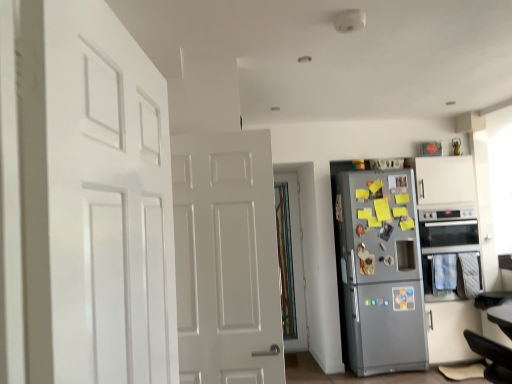
Question: From a real-world perspective, is white matte door at left, positioned as the 1th door in left-to-right order, above or below translucent glass door at center, the 2th door positioned from the left?

Choices:
 (A) below
 (B) above

Answer: (B)

Question: Is white matte door at left, positioned as the 1th door in left-to-right order, wider or thinner than translucent glass door at center, marked as the first door in a right-to-left arrangement?

Choices:
 (A) wide
 (B) thin

Answer: (A)

Question: Considering the real-world distances, which object is closest to the silver metallic oven at right?

Choices:
 (A) translucent glass door at center, the 2th door positioned from the left
 (B) satin silver fridge at right
 (C) black leather swivel chair at lower right
 (D) white matte door at left, positioned as the 1th door in left-to-right order

Answer: (B)

Question: Which object is positioned closest to the white matte door at left, the second door in the right-to-left sequence?

Choices:
 (A) translucent glass door at center, the 2th door positioned from the left
 (B) satin silver fridge at right
 (C) black leather swivel chair at lower right
 (D) silver metallic oven at right

Answer: (C)